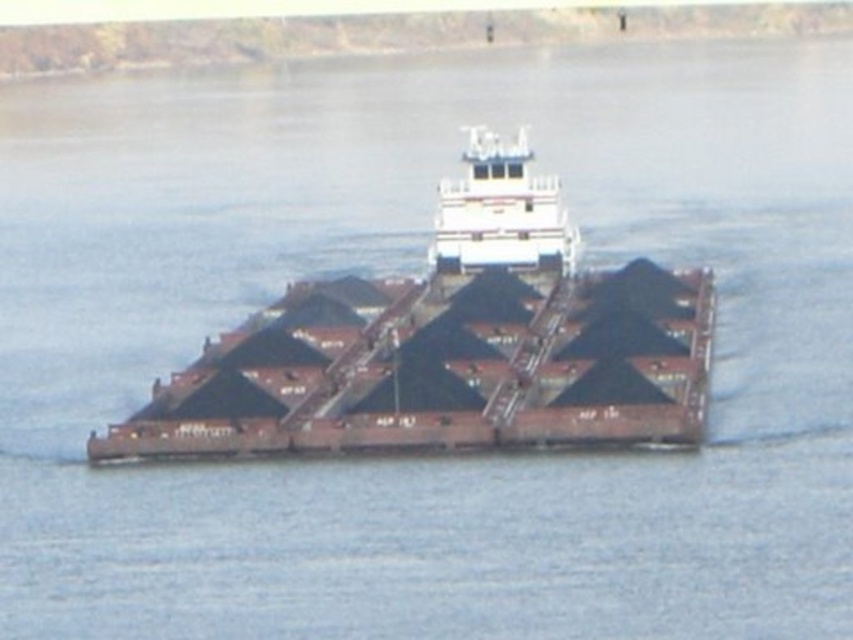
You are standing on the barge and see two points marked on the water surface. The first point is at coordinate point (550, 266) and the second is at point (554, 192). If you want to move from the first point to the second point, which direction should you move relative to the barge?

You should move backward relative to the barge because point (550, 266) is in front of point (554, 192).

You are a crane operator tasked with loading containers onto the brown matte cargo ship at center and the white matte barge at center. Based on their heights, which vessel can accommodate taller containers?

The white matte barge at center has a greater height than the brown matte cargo ship at center, so it can accommodate taller containers.